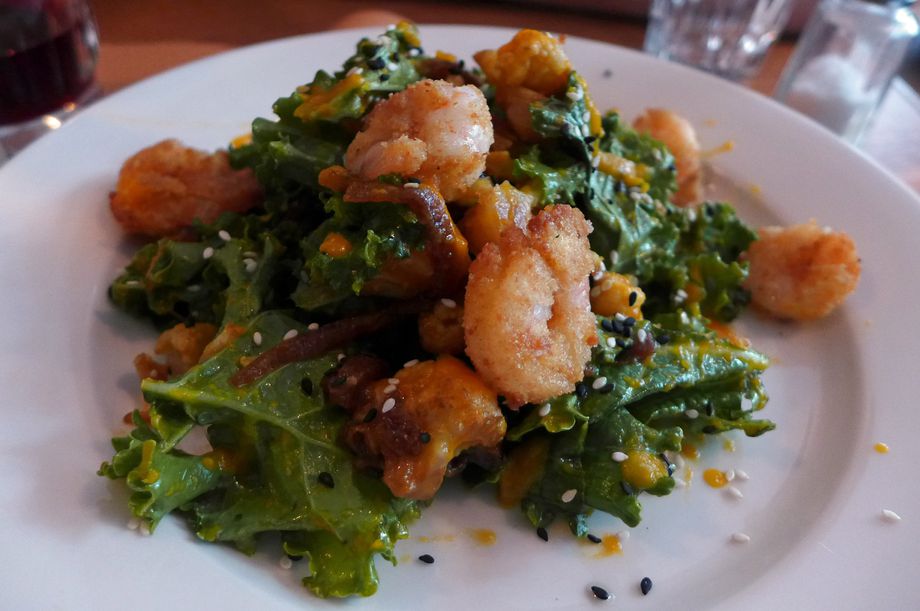
Find the location of a particular element. salt shaker is located at coordinates [x=843, y=82].